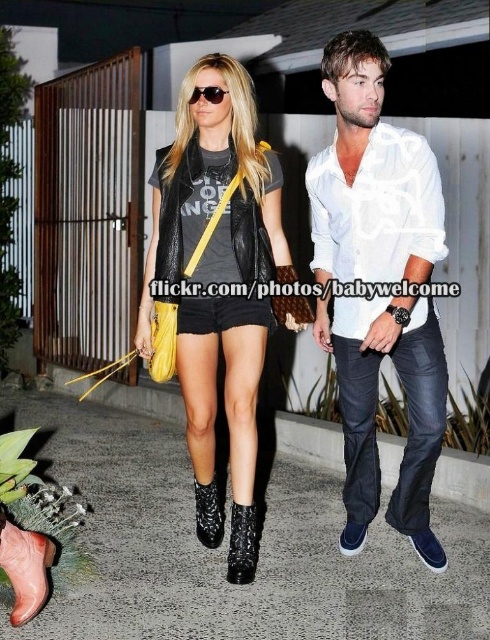
Question: Among these points, which one is nearest to the camera?

Choices:
 (A) (31, 572)
 (B) (200, 513)
 (C) (163, 230)

Answer: (A)

Question: Is leather boot at lower left to the left of black leather shorts at center from the viewer's perspective?

Choices:
 (A) no
 (B) yes

Answer: (B)

Question: Which object is closer to the camera taking this photo?

Choices:
 (A) white cotton shirt at upper right
 (B) black leather shorts at center
 (C) leather boot at lower left
 (D) matte black leather vest at upper center

Answer: (C)

Question: Can you confirm if matte black leather vest at upper center is wider than dark blue denim jeans at center?

Choices:
 (A) yes
 (B) no

Answer: (A)

Question: Based on their relative distances, which object is nearer to the matte black leather vest at upper center?

Choices:
 (A) white cotton shirt at center
 (B) dark blue denim jeans at center
 (C) leather boot at lower left
 (D) black leather shorts at center

Answer: (A)

Question: Can you confirm if dark blue denim jeans at center is positioned to the right of leather boot at lower left?

Choices:
 (A) no
 (B) yes

Answer: (B)